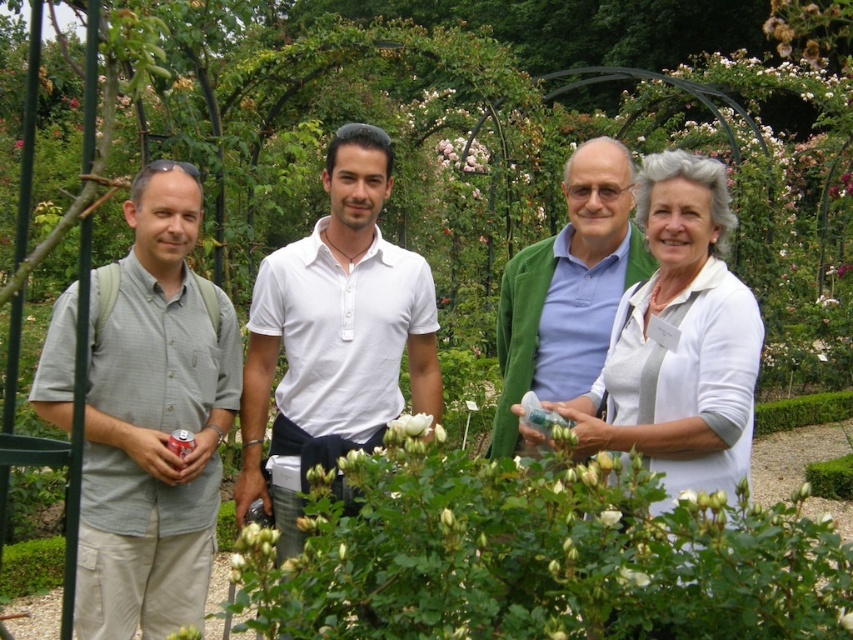
You are a photographer planning to take a group photo of the four people in front of the white matte rose bush at center and the white matte flower at center. To ensure both the people and the flowers are in focus, you need to know which is taller. Which one is taller?

The white matte rose bush at center is taller than the white matte flower at center, so you should adjust your camera settings to focus on the taller rose bush to include both subjects in sharp focus.

You are a gardener who wants to plant a new flower bed between the white matte rose bush at center and the white matte flower at center. Which object should you place the new flower bed closer to if you want the flower bed to be wider than the flower but narrower than the rose bush?

The new flower bed should be placed closer to the white matte flower at center because the white matte rose bush at center might be wider than the white matte flower at center. This ensures the flower bed is wider than the flower but narrower than the rose bush.